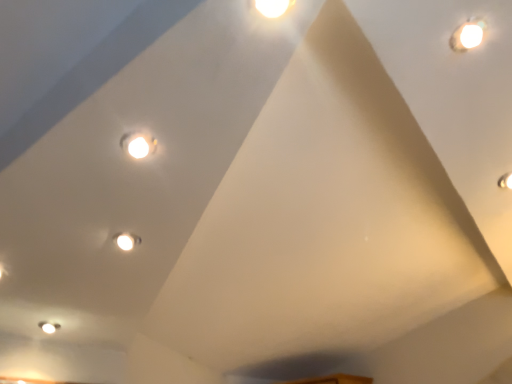
Question: Is matte white light at upper right, which is counted as the first light, starting from the bottom, completely or partially inside white glossy droplight at upper right?

Choices:
 (A) yes
 (B) no

Answer: (B)

Question: From the image's perspective, is white glossy droplight at upper right beneath matte white light at upper right, placed as the second light when sorted from left to right?

Choices:
 (A) yes
 (B) no

Answer: (B)

Question: Can you confirm if white glossy droplight at upper right is taller than matte white light at upper right, placed as the second light when sorted from left to right?

Choices:
 (A) yes
 (B) no

Answer: (B)

Question: Is white glossy droplight at upper right looking in the opposite direction of matte white light at upper right, placed as the second light when sorted from left to right?

Choices:
 (A) no
 (B) yes

Answer: (A)

Question: From a real-world perspective, is white glossy droplight at upper right located beneath matte white light at upper right, the 2th light positioned from the top?

Choices:
 (A) no
 (B) yes

Answer: (A)

Question: Is matte white light at upper right, which is counted as the 1th light, starting from the right, wider or thinner than matte white light at upper center, placed as the second light when sorted from back to front?

Choices:
 (A) wide
 (B) thin

Answer: (A)

Question: From the image's perspective, is matte white light at upper right, acting as the first light starting from the back, located above or below matte white light at upper center, which is the first light in left-to-right order?

Choices:
 (A) below
 (B) above

Answer: (A)

Question: Considering the positions of point (506, 173) and point (133, 150), is point (506, 173) closer or farther from the camera than point (133, 150)?

Choices:
 (A) farther
 (B) closer

Answer: (A)

Question: Is matte white light at upper right, the 2th light positioned from the top, inside the boundaries of matte white light at upper center, placed as the second light when sorted from back to front, or outside?

Choices:
 (A) inside
 (B) outside

Answer: (B)

Question: In terms of height, does matte white light at upper center, arranged as the 1th light when viewed from the top, look taller or shorter compared to matte white light at upper right, the 2th light positioned from the top?

Choices:
 (A) tall
 (B) short

Answer: (B)

Question: From the image's perspective, is matte white light at upper center, placed as the second light when sorted from back to front, located above or below matte white light at upper right, the 2th light from the front?

Choices:
 (A) above
 (B) below

Answer: (A)

Question: Is point (136, 134) closer or farther from the camera than point (504, 182)?

Choices:
 (A) closer
 (B) farther

Answer: (A)

Question: From a real-world perspective, relative to matte white light at upper right, the 2th light positioned from the top, is matte white light at upper center, marked as the first light in a front-to-back arrangement, vertically above or below?

Choices:
 (A) above
 (B) below

Answer: (B)

Question: From a real-world perspective, relative to matte white light at upper right, placed as the second light when sorted from left to right, is white glossy droplight at upper right vertically above or below?

Choices:
 (A) above
 (B) below

Answer: (A)

Question: Is white glossy droplight at upper right to the left or to the right of matte white light at upper right, which is counted as the first light, starting from the bottom, in the image?

Choices:
 (A) right
 (B) left

Answer: (B)